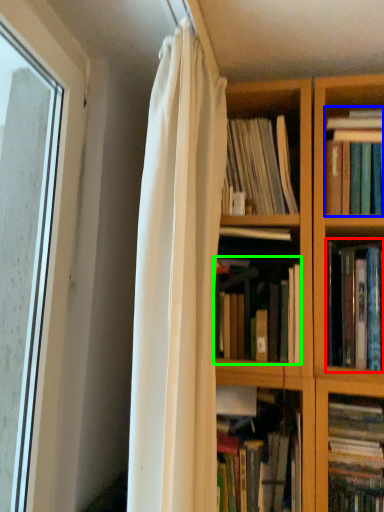
Question: Based on their relative distances, which object is farther from book (highlighted by a red box)? Choose from book (highlighted by a blue box) and book (highlighted by a green box).

Choices:
 (A) book
 (B) book

Answer: (A)